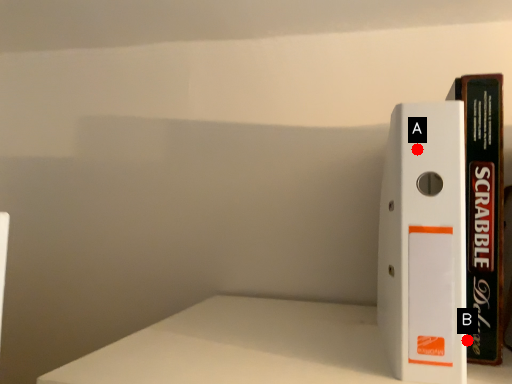
Question: Two points are circled on the image, labeled by A and B beside each circle. Among these points, which one is nearest to the camera?

Choices:
 (A) A is closer
 (B) B is closer

Answer: (B)